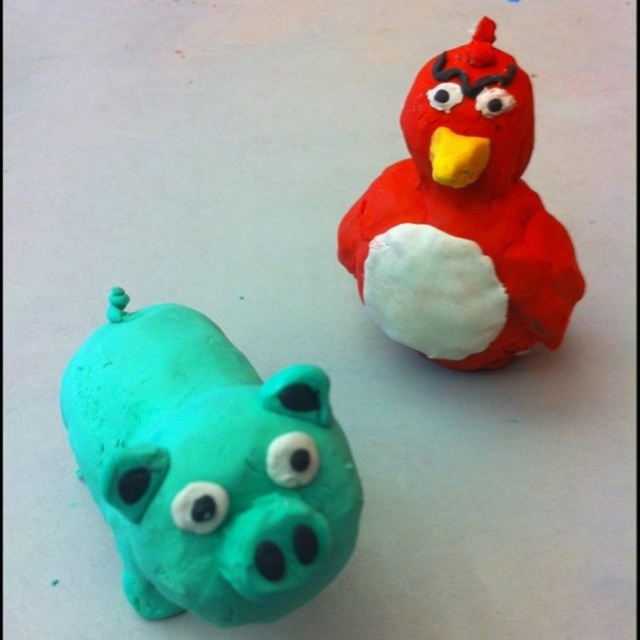
You are an art curator arranging an exhibition. You need to place a teal clay pig at lower left and a matte red clay bird at upper right. Based on their positions, which sculpture is positioned higher on the white surface?

The matte red clay bird at upper right is positioned higher than the teal clay pig at lower left.

You are an art curator arranging an exhibition. You need to place a teal clay pig at lower left and a matte red clay bird at upper right on a display shelf. According to the spatial arrangement in the scene, which sculpture should be placed to the left of the other?

The teal clay pig at lower left should be placed to the left of the matte red clay bird at upper right because the teal clay pig at lower left is positioned on the left side of the matte red clay bird at upper right in the scene.